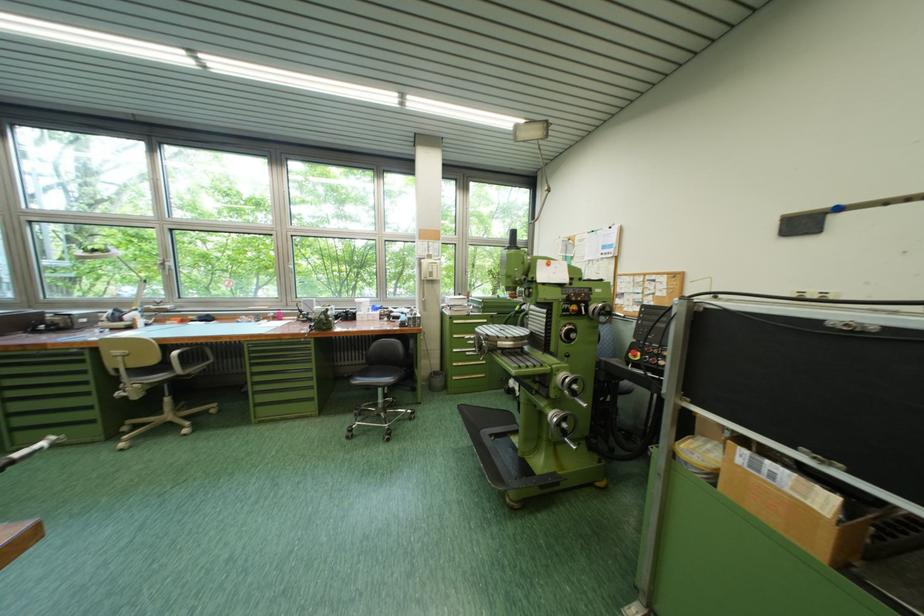
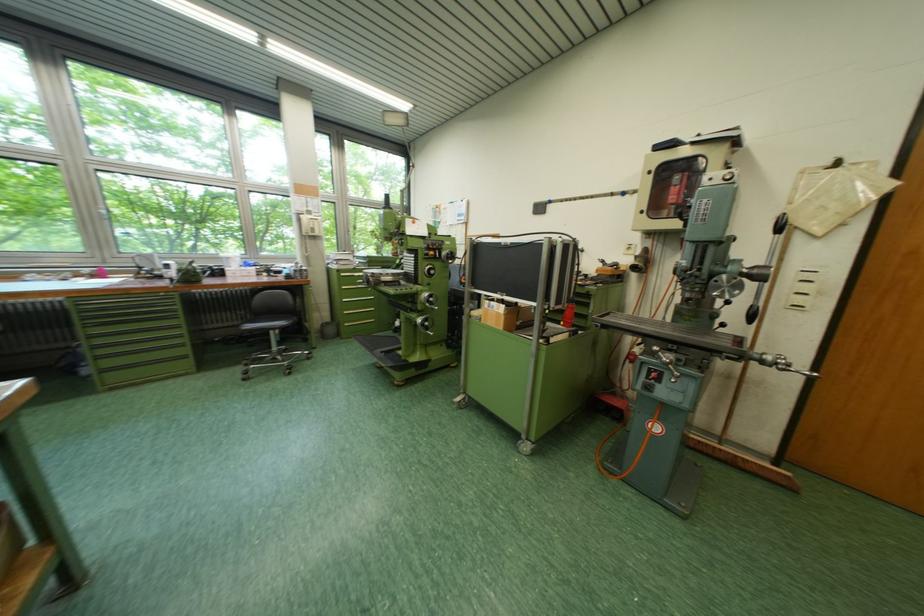
In the second image, find the point that corresponds to point 465,381 in the first image.

(357, 326)